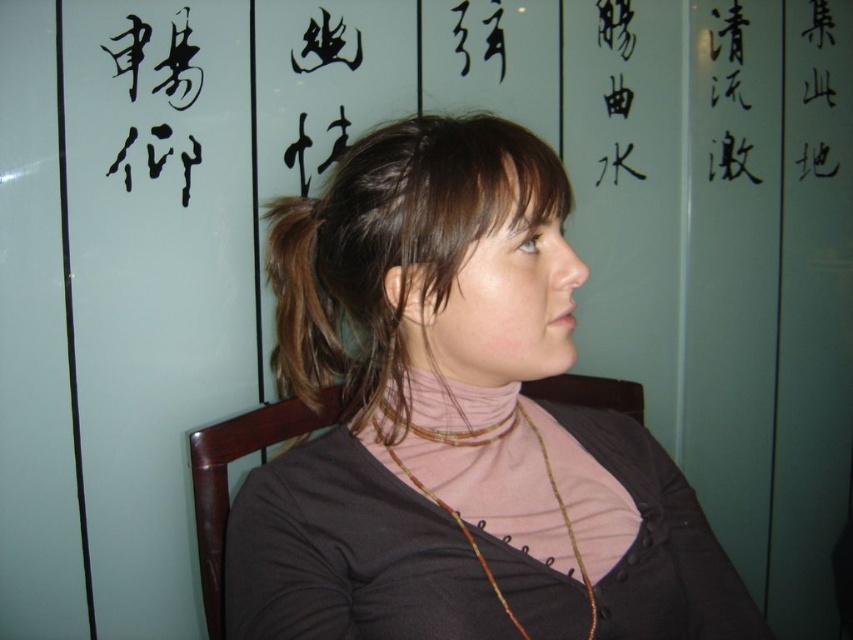
Is multicolored beaded necklace at center taller than matte gold necklace at center?

Indeed, multicolored beaded necklace at center has a greater height compared to matte gold necklace at center.

Who is more distant from viewer, (x=486, y=444) or (x=474, y=364)?

Positioned behind is point (x=486, y=444).

The width and height of the screenshot is (853, 640). In order to click on multicolored beaded necklace at center in this screenshot , I will do `click(476, 448)`.

Who is shorter, brown shiny hair at center or brown shiny hair at upper left?

brown shiny hair at center

Describe the element at coordinates (395, 248) in the screenshot. I see `brown shiny hair at center` at that location.

I want to click on brown shiny hair at center, so click(395, 248).

Based on the photo, is matte brown hair at center behind brown woven necklace at center?

That is False.

Between point (437, 177) and point (396, 428), which one is positioned in front?

Positioned in front is point (437, 177).

Image resolution: width=853 pixels, height=640 pixels. Find the location of `matte brown hair at center`. matte brown hair at center is located at coordinates (457, 448).

This screenshot has width=853, height=640. In order to click on matte brown hair at center in this screenshot , I will do `click(457, 448)`.